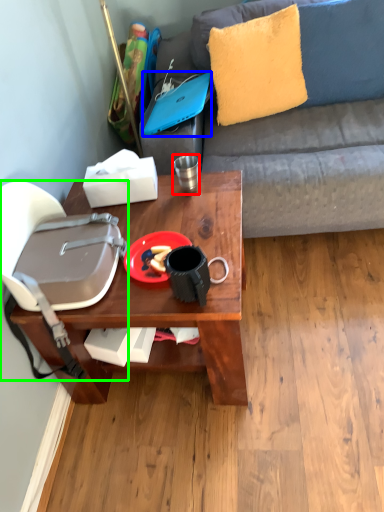
Question: Which is nearer to the coffee cup (highlighted by a red box)? laptop (highlighted by a blue box) or handbag (highlighted by a green box).

Choices:
 (A) laptop
 (B) handbag

Answer: (A)